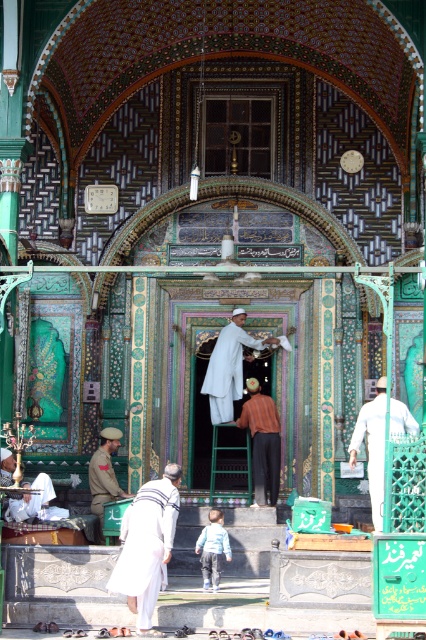
You are a visitor at the mosque entrance and see the white cotton robe at lower center and the light blue cotton shirt at center. Which clothing item is taller?

The white cotton robe at lower center is taller than the light blue cotton shirt at center.

You are a visitor approaching the mosque entrance and see the white cotton robe at lower center and the light blue cotton shirt at center. Which clothing item is positioned higher up in the scene?

The white cotton robe at lower center is located above the light blue cotton shirt at center, so it is positioned higher up in the scene.